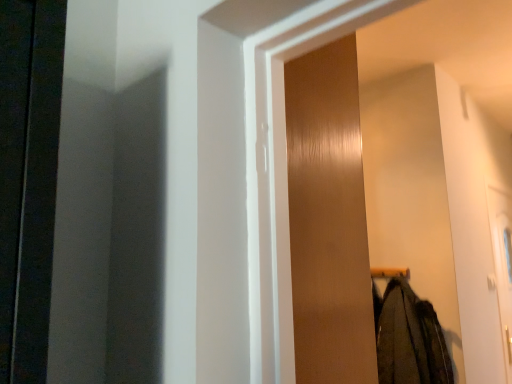
Question: Considering the relative positions of wooden screen door at center and dark green wool coat at lower right in the image provided, is wooden screen door at center to the right of dark green wool coat at lower right from the viewer's perspective?

Choices:
 (A) no
 (B) yes

Answer: (A)

Question: Is wooden screen door at center taller than dark green wool coat at lower right?

Choices:
 (A) yes
 (B) no

Answer: (A)

Question: Is wooden screen door at center wider than dark green wool coat at lower right?

Choices:
 (A) yes
 (B) no

Answer: (A)

Question: Can you confirm if wooden screen door at center is smaller than dark green wool coat at lower right?

Choices:
 (A) no
 (B) yes

Answer: (A)

Question: Can you confirm if wooden screen door at center is bigger than dark green wool coat at lower right?

Choices:
 (A) no
 (B) yes

Answer: (B)

Question: Is wooden screen door at center looking in the opposite direction of dark green wool coat at lower right?

Choices:
 (A) no
 (B) yes

Answer: (A)

Question: Is dark green wool coat at lower right positioned behind wooden screen door at center?

Choices:
 (A) yes
 (B) no

Answer: (A)

Question: Does dark green wool coat at lower right come in front of wooden screen door at center?

Choices:
 (A) no
 (B) yes

Answer: (A)

Question: Can you confirm if dark green wool coat at lower right is wider than wooden screen door at center?

Choices:
 (A) yes
 (B) no

Answer: (B)

Question: From a real-world perspective, does dark green wool coat at lower right sit lower than wooden screen door at center?

Choices:
 (A) no
 (B) yes

Answer: (B)

Question: Considering the relative sizes of dark green wool coat at lower right and wooden screen door at center in the image provided, is dark green wool coat at lower right bigger than wooden screen door at center?

Choices:
 (A) no
 (B) yes

Answer: (A)

Question: Is dark green wool coat at lower right beside wooden screen door at center?

Choices:
 (A) no
 (B) yes

Answer: (A)

Question: In terms of size, does wooden screen door at center appear bigger or smaller than dark green wool coat at lower right?

Choices:
 (A) big
 (B) small

Answer: (A)